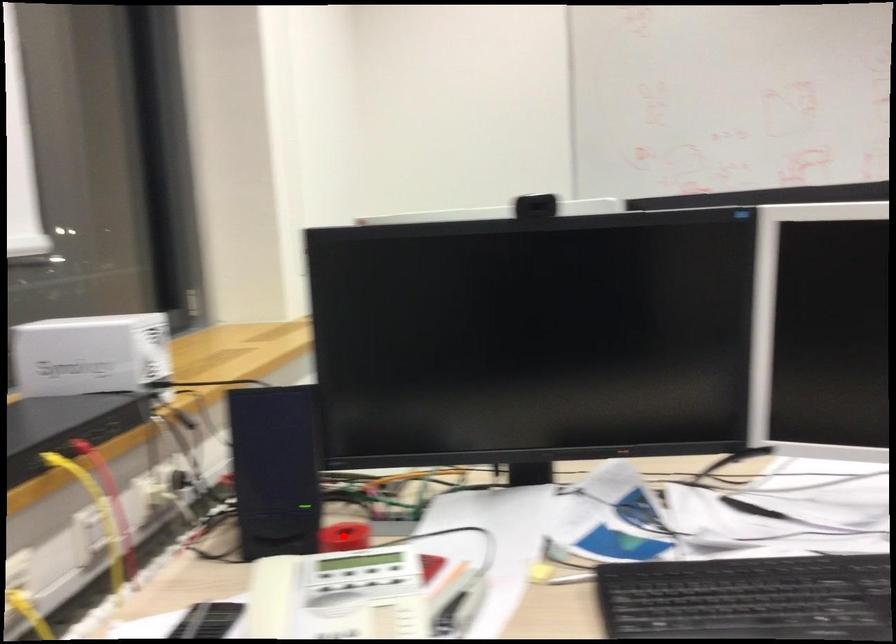
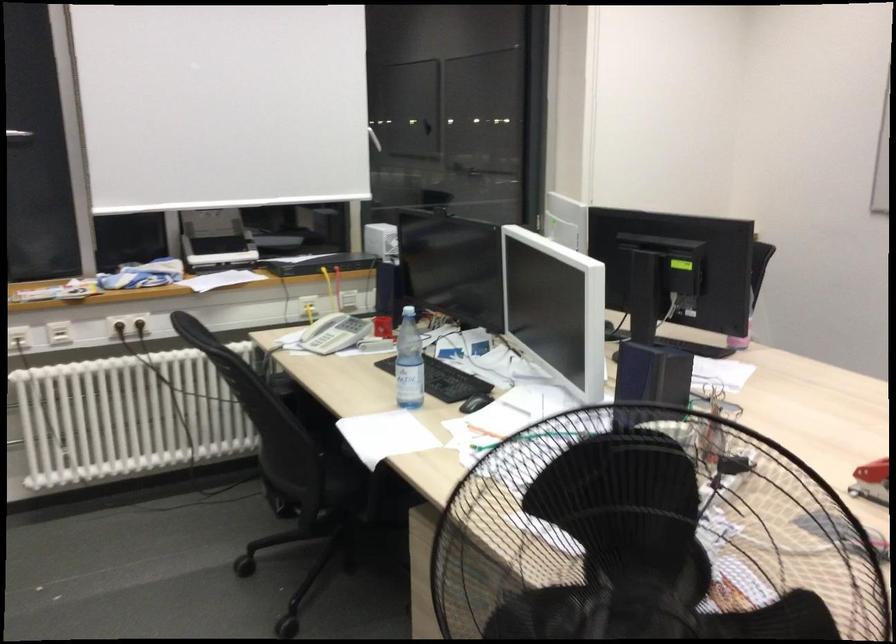
Question: I am providing you with two images of the same scene from different viewpoints. A red point is marked on the first image. At the location where the point appears in image 1, is it still visible in image 2?

Choices:
 (A) Yes
 (B) No

Answer: (B)